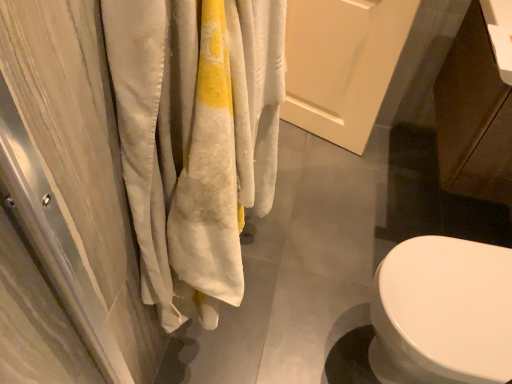
Question: Is brown matte cabinet at lower right placed right next to white matte door at center?

Choices:
 (A) yes
 (B) no

Answer: (B)

Question: Could you tell me if brown matte cabinet at lower right is turned towards white matte door at center?

Choices:
 (A) no
 (B) yes

Answer: (B)

Question: Considering the relative sizes of brown matte cabinet at lower right and white matte door at center in the image provided, is brown matte cabinet at lower right bigger than white matte door at center?

Choices:
 (A) yes
 (B) no

Answer: (A)

Question: Would you say white matte door at center is part of brown matte cabinet at lower right's contents?

Choices:
 (A) no
 (B) yes

Answer: (A)

Question: Can you confirm if brown matte cabinet at lower right is smaller than white matte door at center?

Choices:
 (A) no
 (B) yes

Answer: (A)

Question: From a real-world perspective, is brown matte cabinet at lower right positioned over white matte door at center based on gravity?

Choices:
 (A) yes
 (B) no

Answer: (A)

Question: Is white matte door at center positioned with its back to brown matte cabinet at lower right?

Choices:
 (A) yes
 (B) no

Answer: (B)

Question: Does white matte door at center appear on the right side of brown matte cabinet at lower right?

Choices:
 (A) no
 (B) yes

Answer: (A)

Question: From the image's perspective, is white matte door at center under brown matte cabinet at lower right?

Choices:
 (A) no
 (B) yes

Answer: (A)

Question: Does white matte door at center lie in front of brown matte cabinet at lower right?

Choices:
 (A) no
 (B) yes

Answer: (A)

Question: From the image's perspective, is white matte door at center above brown matte cabinet at lower right?

Choices:
 (A) no
 (B) yes

Answer: (B)

Question: Could you tell me if white matte door at center is facing brown matte cabinet at lower right?

Choices:
 (A) no
 (B) yes

Answer: (A)

Question: Considering the positions of white matte door at center and brown matte cabinet at lower right in the image, is white matte door at center taller or shorter than brown matte cabinet at lower right?

Choices:
 (A) short
 (B) tall

Answer: (B)